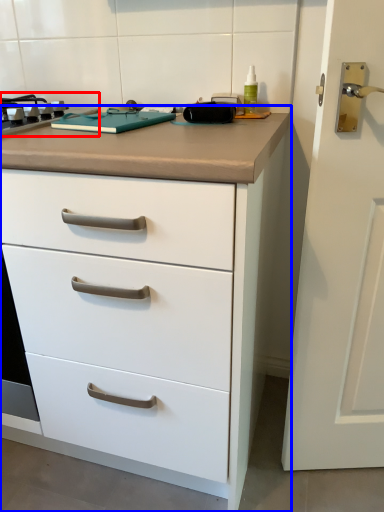
Question: Among these objects, which one is nearest to the camera, gas stove (highlighted by a red box) or chest of drawers (highlighted by a blue box)?

Choices:
 (A) gas stove
 (B) chest of drawers

Answer: (B)